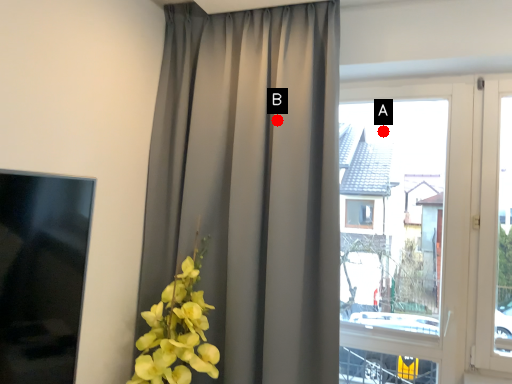
Question: Two points are circled on the image, labeled by A and B beside each circle. Which of the following is the farthest from the observer?

Choices:
 (A) A is further
 (B) B is further

Answer: (A)